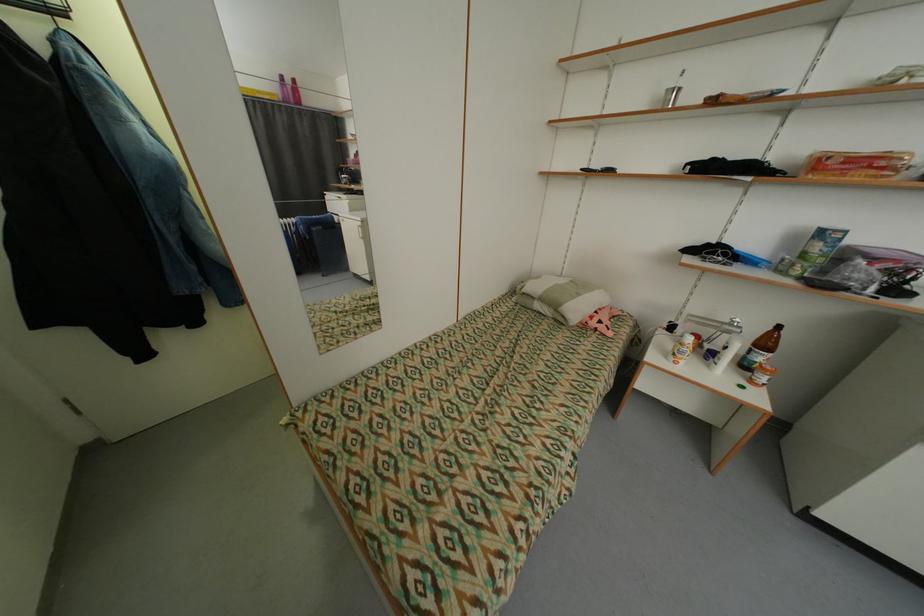
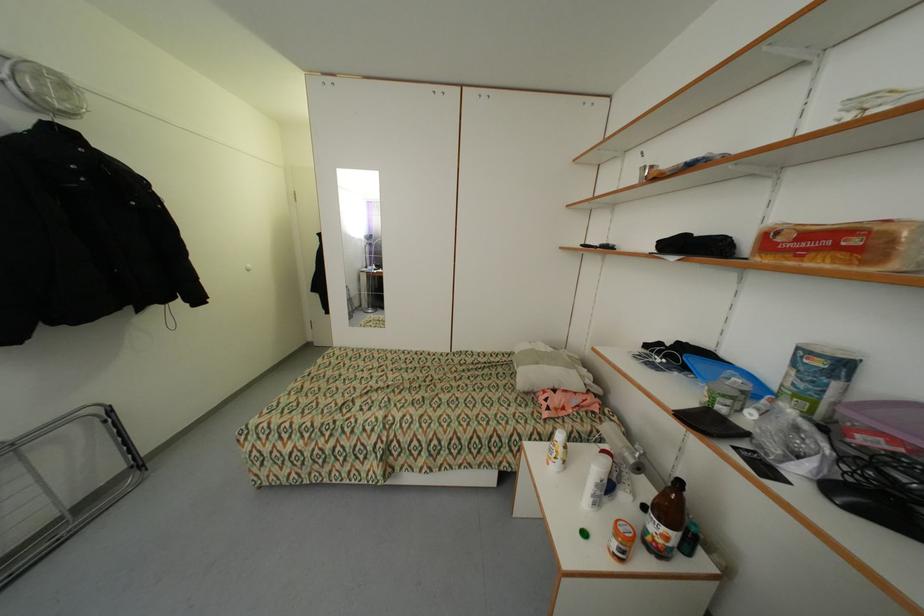
Locate, in the second image, the point that corresponds to point (889, 164) in the first image.

(860, 241)